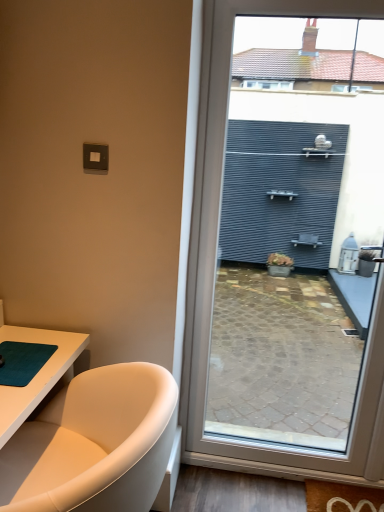
Image resolution: width=384 pixels, height=512 pixels. In order to click on free spot above teal matte yoga mat at lower left (from a real-world perspective) in this screenshot , I will do `click(21, 355)`.